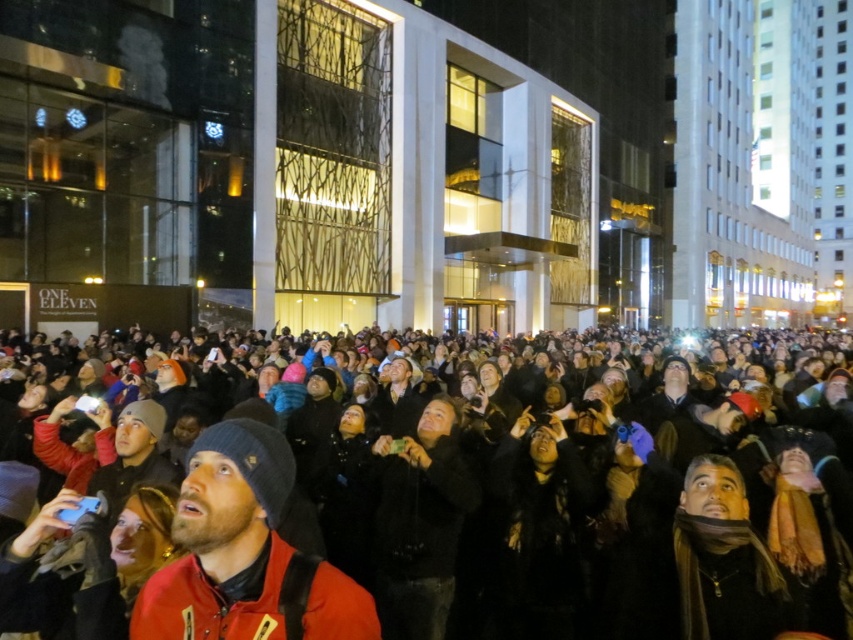
You are standing at the edge of the crowd and want to reach the red matte jacket at center without getting too close to the dark clothing crowd at center. What is the minimum distance you need to move forward?

The dark clothing crowd at center is 3.38 meters away from the red matte jacket at center. To avoid getting too close to the dark clothing crowd at center, you should move forward at least 3.38 meters to reach the red matte jacket at center safely.

You are standing at the point marked by the coordinates point (x=477, y=536) in the image. What do you see around you?

You are surrounded by a dark clothing crowd at center.

You are a photographer at the event and want to capture a clear image of the red matte jacket at center without the dark clothing crowd at center blocking it. What should you do?

The dark clothing crowd at center is bigger than the red matte jacket at center, so you should adjust your camera angle to focus on the red matte jacket at center while avoiding the larger crowd.